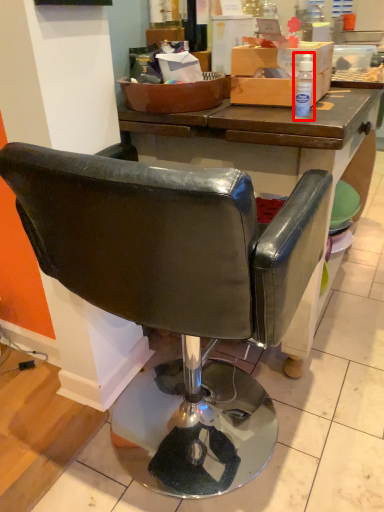
Question: From the image's perspective, where is bottle (annotated by the red box) located in relation to chair in the image?

Choices:
 (A) above
 (B) below

Answer: (A)